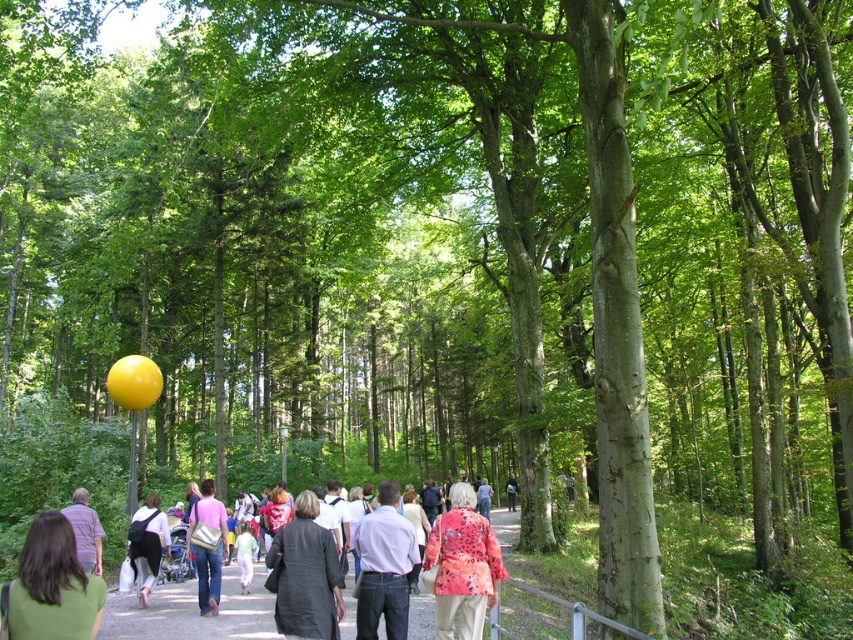
Does pink fabric bag at center appear on the right side of black fabric backpack at center?

Correct, you'll find pink fabric bag at center to the right of black fabric backpack at center.

Who is shorter, pink fabric bag at center or black fabric backpack at center?

Standing shorter between the two is black fabric backpack at center.

Locate an element on the screen. pink fabric bag at center is located at coordinates (207, 547).

Image resolution: width=853 pixels, height=640 pixels. Identify the location of pink fabric bag at center. (207, 547).

Consider the image. Does green fabric jacket at lower left have a greater height compared to pink fabric bag at center?

No.

Is green fabric jacket at lower left further to the viewer compared to pink fabric bag at center?

No, it is in front of pink fabric bag at center.

Where is `green fabric jacket at lower left`? This screenshot has width=853, height=640. green fabric jacket at lower left is located at coordinates (51, 586).

You are a GUI agent. You are given a task and a screenshot of the screen. Output one action in this format:
    pyautogui.click(x=<x>, y=<y>)
    Task: Click on the green fabric jacket at lower left
    Image resolution: width=853 pixels, height=640 pixels.
    Given the screenshot: What is the action you would take?
    pyautogui.click(x=51, y=586)

The image size is (853, 640). What do you see at coordinates (463, 564) in the screenshot? I see `floral-patterned fabric at center` at bounding box center [463, 564].

Which of these two, floral-patterned fabric at center or floral fabric jacket at center, stands shorter?

floral-patterned fabric at center

Between point (483, 536) and point (503, 486), which one is positioned in front?

Point (483, 536) is more forward.

What are the coordinates of `floral-patterned fabric at center` in the screenshot? It's located at (463, 564).